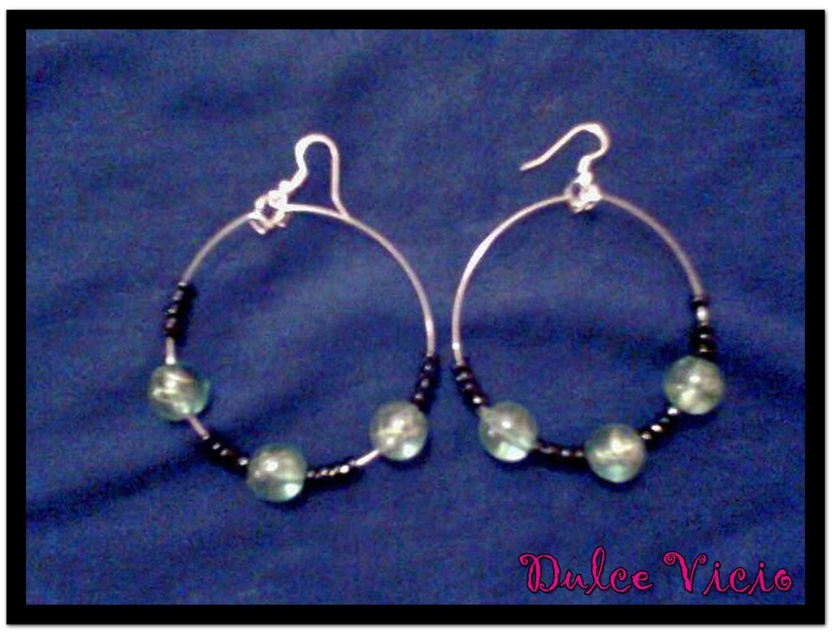
Looking at this image, you are a photographer trying to capture the hoop earrings displayed in the image. You need to ensure that the focal point at point (424,301) is sharp. Given that your camera has a depth of field that can sharply focus objects within 1.3 meters to 1.5 meters from the lens, will the focal point be within the sharp range?

The distance between point (424,301) and the camera is 1.41 meters, which falls within the depth of field range of 1.3 to 1.5 meters. Therefore, the focal point will be sharply focused.